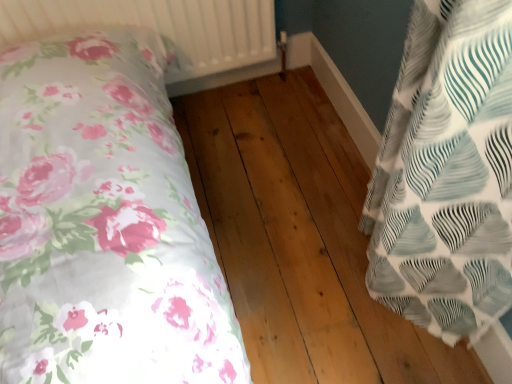
You are a GUI agent. You are given a task and a screenshot of the screen. Output one action in this format:
    pyautogui.click(x=<x>, y=<y>)
    Task: Click on the vacant area on top of white textured fabric pillow at right (from a real-world perspective)
    This screenshot has width=512, height=384.
    Given the screenshot: What is the action you would take?
    pyautogui.click(x=357, y=92)